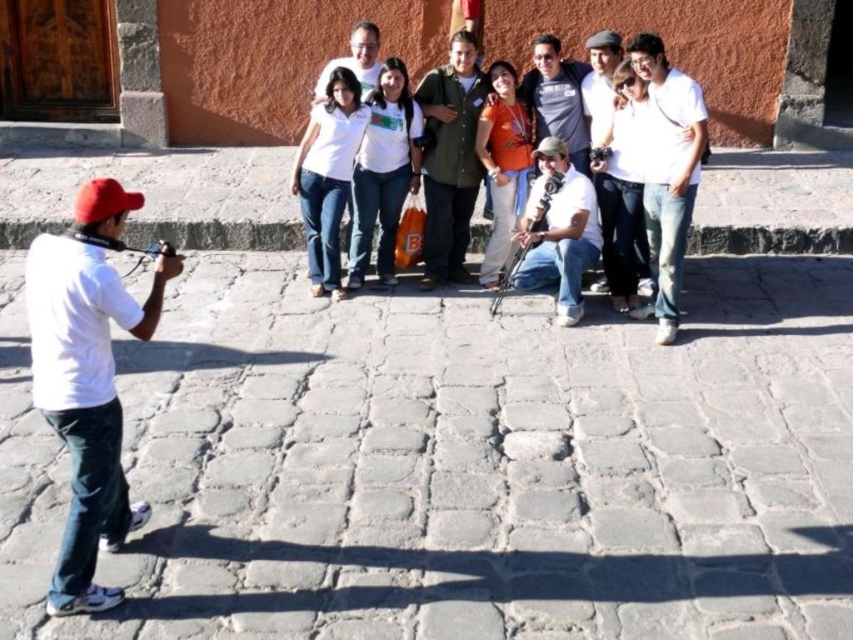
Is matte white shirt at center to the right of matte white camera at center from the viewer's perspective?

→ Yes, matte white shirt at center is to the right of matte white camera at center.

Where is `matte white shirt at center`? matte white shirt at center is located at coordinates (614, 179).

Is white cotton shirt at upper right closer to the viewer compared to white matte shirt at center?

Yes, white cotton shirt at upper right is in front of white matte shirt at center.

Can you confirm if white cotton shirt at upper right is wider than white matte shirt at center?

Yes.

Does point (646, 33) come farther from viewer compared to point (354, 38)?

That is True.

At what (x,y) coordinates should I click in order to perform the action: click on white cotton shirt at upper right. Please return your answer as a coordinate pair (x, y). Looking at the image, I should click on (668, 170).

From the picture: Who is positioned more to the right, white matte shirt at left or white matte shirt at center?

Positioned to the right is white matte shirt at center.

This screenshot has height=640, width=853. Identify the location of white matte shirt at left. (86, 378).